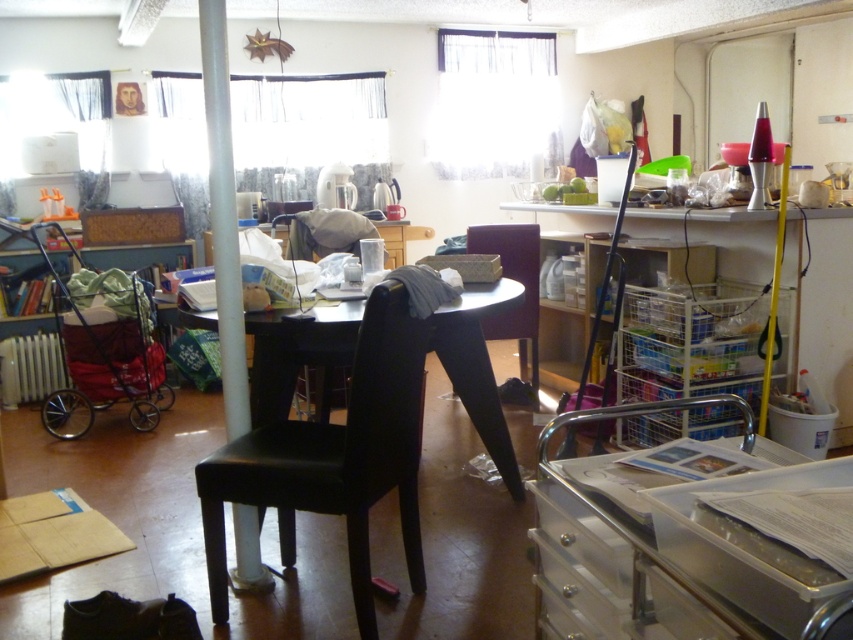
Who is positioned more to the right, black leather chair at center or black leather table at center?

black leather table at center

Is point (277, 516) farther from camera compared to point (401, 288)?

Yes, point (277, 516) is behind point (401, 288).

The image size is (853, 640). What are the coordinates of `black leather chair at center` in the screenshot? It's located at (334, 458).

Identify the location of black leather chair at center. (334, 458).

Who is positioned more to the right, metallic pole at center or matte black chair at center?

matte black chair at center

Who is taller, metallic pole at center or matte black chair at center?

metallic pole at center is taller.

Does point (230, 148) lie in front of point (508, 264)?

Yes, it is in front of point (508, 264).

You are a GUI agent. You are given a task and a screenshot of the screen. Output one action in this format:
    pyautogui.click(x=<x>, y=<y>)
    Task: Click on the metallic pole at center
    The width and height of the screenshot is (853, 640).
    Given the screenshot: What is the action you would take?
    pyautogui.click(x=223, y=216)

Does black leather chair at center have a lesser width compared to matte black chair at center?

No.

Does black leather chair at center have a smaller size compared to matte black chair at center?

No, black leather chair at center is not smaller than matte black chair at center.

Is point (281, 544) positioned behind point (479, 244)?

No, it is in front of (479, 244).

You are a GUI agent. You are given a task and a screenshot of the screen. Output one action in this format:
    pyautogui.click(x=<x>, y=<y>)
    Task: Click on the black leather chair at center
    
    Given the screenshot: What is the action you would take?
    point(334,458)